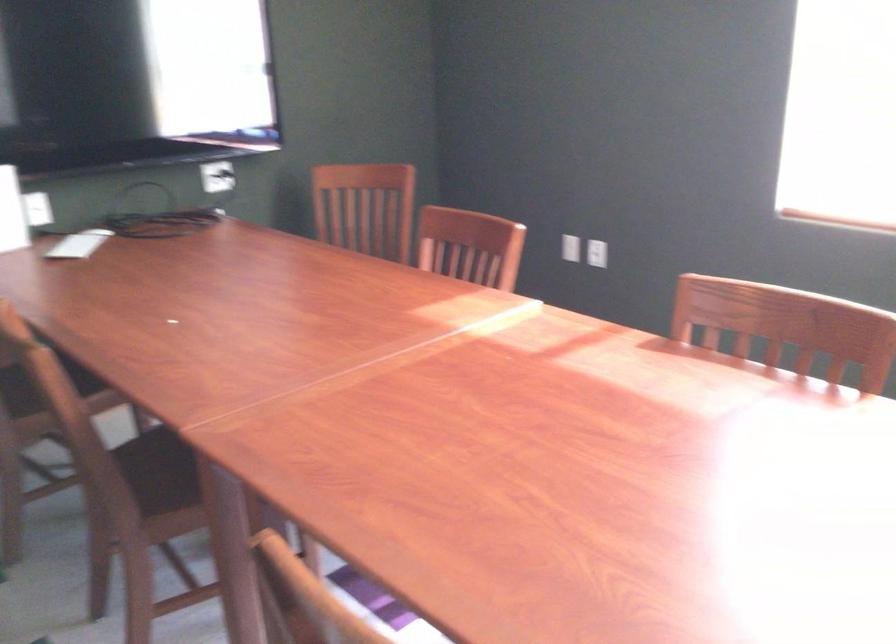
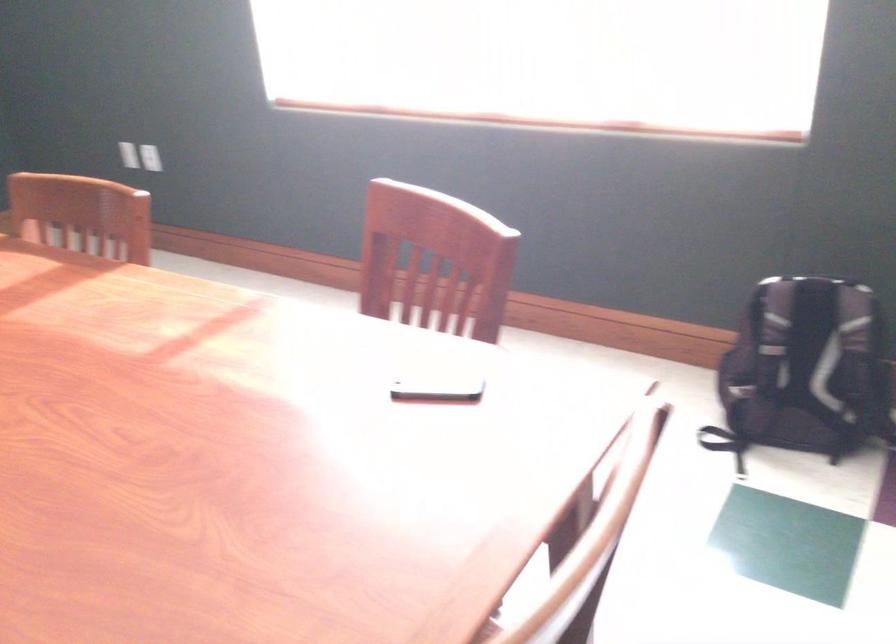
Question: The images are taken continuously from a first-person perspective. In which direction are you moving?

Choices:
 (A) Left
 (B) Right
 (C) Forward
 (D) Backward

Answer: (B)